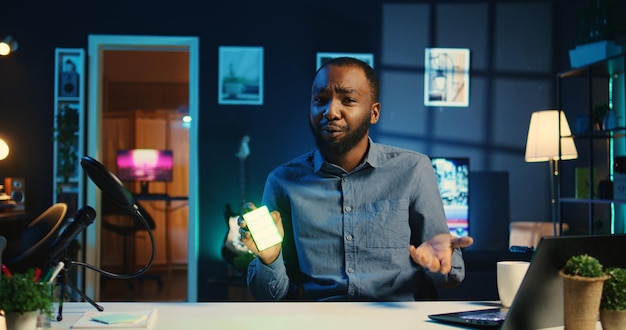
Locate an element on the screen. The image size is (626, 330). coffee cup is located at coordinates (513, 275).